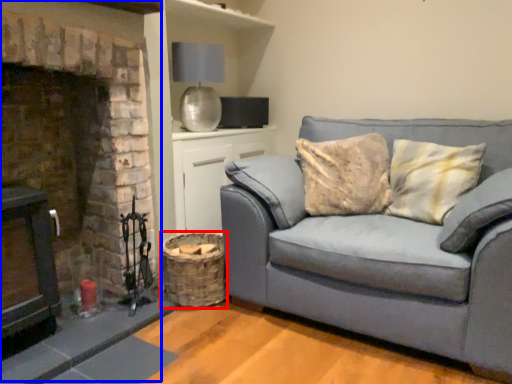
Question: Which object appears farthest to the camera in this image, basket (highlighted by a red box) or fireplace (highlighted by a blue box)?

Choices:
 (A) basket
 (B) fireplace

Answer: (A)